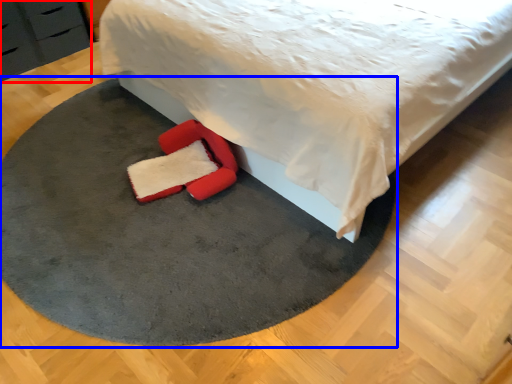
Question: Among these objects, which one is farthest to the camera, dresser (highlighted by a red box) or mat (highlighted by a blue box)?

Choices:
 (A) dresser
 (B) mat

Answer: (A)